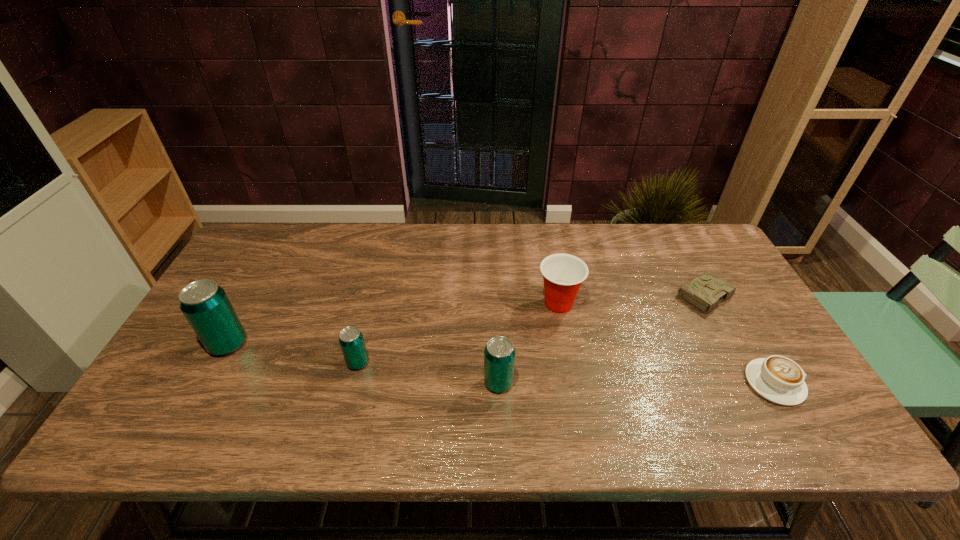
This screenshot has width=960, height=540. I want to click on vacant space that's between the leftmost object and the third object from right to left, so click(x=394, y=324).

Where is `free point between the leftmost object and the shortest beer can`? The height and width of the screenshot is (540, 960). free point between the leftmost object and the shortest beer can is located at coordinates (293, 353).

Where is `free space that is in between the fifth tallest object and the fourth object from right to left`? This screenshot has width=960, height=540. free space that is in between the fifth tallest object and the fourth object from right to left is located at coordinates (636, 383).

The image size is (960, 540). Identify the location of object that stands as the fourth closest to the fourth object from left to right. (351, 340).

Select which object is the fifth closest to the third object from left to right. Please provide its 2D coordinates. Your answer should be formatted as a tuple, i.e. [(x, y)], where the tuple contains the x and y coordinates of a point satisfying the conditions above.

[(206, 306)]

This screenshot has height=540, width=960. Find the location of `beer can identified as the closest to the tallest beer can`. beer can identified as the closest to the tallest beer can is located at coordinates (351, 340).

What are the coordinates of `beer can that stands as the closest to the rightmost beer can` in the screenshot? It's located at (351, 340).

Identify the location of vacant area in the image that satisfies the following two spatial constraints: 1. on the back side of the rightmost beer can; 2. on the right side of the shortest object. Image resolution: width=960 pixels, height=540 pixels. (495, 296).